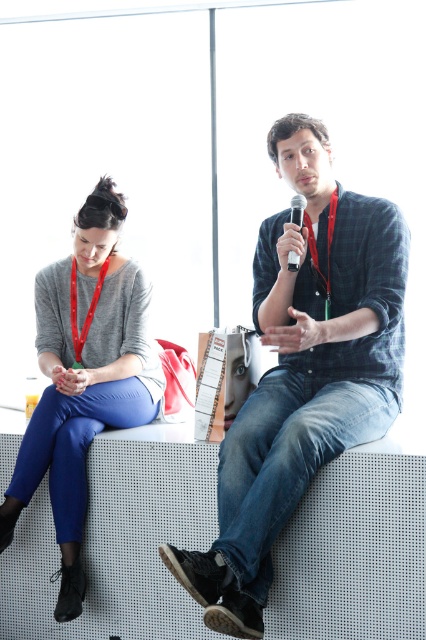
You are standing in the conference room and see the bench with two people. There is a point marked at coordinates (302, 372) on the image. What object is located at that point?

The point at coordinates (302, 372) marks denim jeans at center.

You are organizing a photo shoot and need to ensure that all clothing items in the scene are visible. Given that the denim jeans at center and the matte gray sweater at left are part of the outfits, which clothing item might be partially obscured if the camera angle is too low?

The denim jeans at center is taller than the matte gray sweater at left, so if the camera angle is too low, the denim jeans at center might partially obscure the matte gray sweater at left.